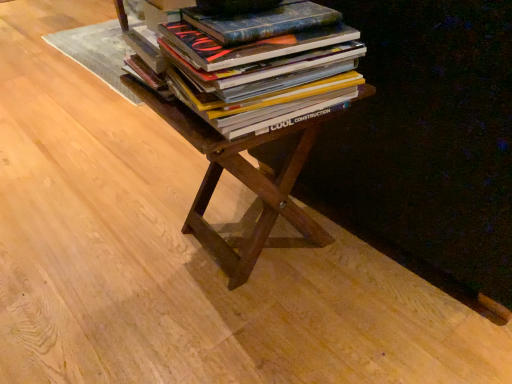
Where is `unoccupied area in front of brown wood table at center`? unoccupied area in front of brown wood table at center is located at coordinates (244, 334).